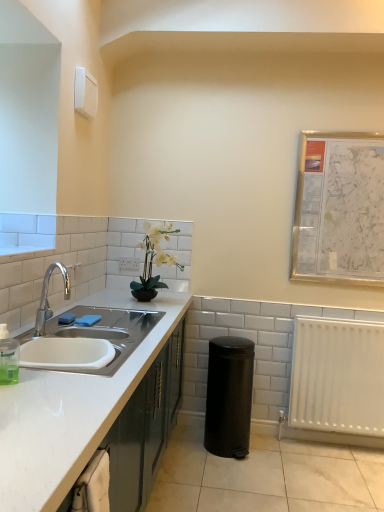
Question: From the image's perspective, is white matte vase at center above white matte radiator at lower right?

Choices:
 (A) no
 (B) yes

Answer: (B)

Question: Considering the relative sizes of white matte vase at center and white matte radiator at lower right in the image provided, is white matte vase at center smaller than white matte radiator at lower right?

Choices:
 (A) yes
 (B) no

Answer: (A)

Question: From a real-world perspective, is white matte vase at center physically above white matte radiator at lower right?

Choices:
 (A) no
 (B) yes

Answer: (B)

Question: Is white matte vase at center outside white matte radiator at lower right?

Choices:
 (A) yes
 (B) no

Answer: (A)

Question: Can you confirm if white matte vase at center is taller than white matte radiator at lower right?

Choices:
 (A) yes
 (B) no

Answer: (B)

Question: In terms of size, does black matte trash can at lower right appear bigger or smaller than white matte radiator at lower right?

Choices:
 (A) small
 (B) big

Answer: (B)

Question: Which is correct: black matte trash can at lower right is inside white matte radiator at lower right, or outside of it?

Choices:
 (A) inside
 (B) outside

Answer: (B)

Question: In terms of height, does black matte trash can at lower right look taller or shorter compared to white matte radiator at lower right?

Choices:
 (A) tall
 (B) short

Answer: (B)

Question: Considering the relative positions of black matte trash can at lower right and white matte radiator at lower right in the image provided, is black matte trash can at lower right to the left or to the right of white matte radiator at lower right?

Choices:
 (A) left
 (B) right

Answer: (A)

Question: Which is correct: white matte cabinet at left is inside white matte vase at center, or outside of it?

Choices:
 (A) outside
 (B) inside

Answer: (A)

Question: In the image, is white matte cabinet at left positioned in front of or behind white matte vase at center?

Choices:
 (A) behind
 (B) front

Answer: (B)

Question: Considering the positions of white matte cabinet at left and white matte vase at center in the image, is white matte cabinet at left wider or thinner than white matte vase at center?

Choices:
 (A) wide
 (B) thin

Answer: (A)

Question: Is point pos(157,380) positioned closer to the camera than point pos(140,278)?

Choices:
 (A) farther
 (B) closer

Answer: (B)

Question: Which is correct: white matte cabinet at left is inside white matte radiator at lower right, or outside of it?

Choices:
 (A) outside
 (B) inside

Answer: (A)

Question: From a real-world perspective, is white matte cabinet at left above or below white matte radiator at lower right?

Choices:
 (A) above
 (B) below

Answer: (B)